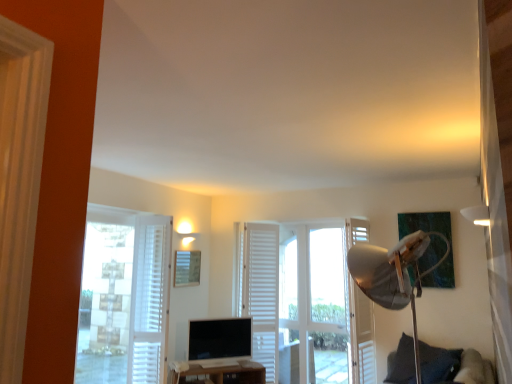
In order to face white textured curtain at left, the second curtain when ordered from right to left, should I rotate leftwards or rightwards?

A 13.966 degree turn to the left will do.

This screenshot has height=384, width=512. In order to click on white textured curtain at left, which ranks as the 1th curtain in front-to-back order in this screenshot , I will do `click(150, 300)`.

Describe the element at coordinates (437, 363) in the screenshot. I see `dark blue fabric pillow at lower right` at that location.

Find the location of a particular element. Image resolution: width=512 pixels, height=384 pixels. wooden picture frame at center is located at coordinates (187, 268).

Measure the distance between point (349, 364) and camera.

The depth of point (349, 364) is 4.70 meters.

Image resolution: width=512 pixels, height=384 pixels. What do you see at coordinates (262, 293) in the screenshot?
I see `white matte curtain at center, the second curtain when ordered from left to right` at bounding box center [262, 293].

Locate an element on the screen. This screenshot has height=384, width=512. white textured curtain at left, which is counted as the 2th curtain, starting from the back is located at coordinates (150, 300).

From the image's perspective, relative to white matte lampshade at upper right, is dark blue fabric pillow at lower right above or below?

Clearly, from the image's perspective, dark blue fabric pillow at lower right is below white matte lampshade at upper right.

From a real-world perspective, does dark blue fabric pillow at lower right sit lower than white matte lampshade at upper right?

Indeed, from a real-world perspective, dark blue fabric pillow at lower right is positioned beneath white matte lampshade at upper right.

Which is farther, [398,365] or [477,211]?

The point [477,211] is farther.

Is dark blue fabric pillow at lower right at the right side of white matte lampshade at upper right?

Yes, dark blue fabric pillow at lower right is to the right of white matte lampshade at upper right.

Which is more to the right, white wooden screen door at right or white wooden door at center?

Positioned to the right is white wooden screen door at right.

Is white wooden screen door at right positioned in front of white wooden door at center?

Yes, it is in front of white wooden door at center.

How different are the orientations of white wooden screen door at right and white wooden door at center in degrees?

72.8 degrees.

Is white wooden screen door at right facing towards white wooden door at center?

No, white wooden screen door at right is not turned towards white wooden door at center.

Which is behind, point (192, 343) or point (469, 211)?

Point (192, 343)

Which of these two, matte black computer monitor at center or white matte lampshade at upper right, is bigger?

matte black computer monitor at center is bigger.

Considering the relative sizes of matte black computer monitor at center and white matte lampshade at upper right in the image provided, is matte black computer monitor at center thinner than white matte lampshade at upper right?

Indeed, matte black computer monitor at center has a lesser width compared to white matte lampshade at upper right.

From a real-world perspective, between matte black computer monitor at center and white matte lampshade at upper right, who is vertically higher?

white matte lampshade at upper right is physically above.

Does matte black computer monitor at center appear on the right side of dark blue fabric pillow at lower right?

No.

Considering the positions of point (190, 348) and point (403, 339), is point (190, 348) closer or farther from the camera than point (403, 339)?

Clearly, point (190, 348) is more distant from the camera than point (403, 339).

Which is behind, matte black computer monitor at center or dark blue fabric pillow at lower right?

matte black computer monitor at center is further from the camera.

Can you confirm if matte black computer monitor at center is taller than dark blue fabric pillow at lower right?

No, matte black computer monitor at center is not taller than dark blue fabric pillow at lower right.

Consider the image. Measure the distance between white wooden screen door at right and wooden picture frame at center.

2.08 meters.

Is white wooden screen door at right turned away from wooden picture frame at center?

white wooden screen door at right does not have its back to wooden picture frame at center.

Considering the sizes of objects white wooden screen door at right and wooden picture frame at center in the image provided, who is taller, white wooden screen door at right or wooden picture frame at center?

With more height is white wooden screen door at right.

Does point (351, 241) appear closer or farther from the camera than point (186, 276)?

Point (351, 241).

Can you confirm if white matte lampshade at upper right is smaller than brown wooden tv stand at lower center?

Indeed, white matte lampshade at upper right has a smaller size compared to brown wooden tv stand at lower center.

From the image's perspective, which one is positioned higher, white matte lampshade at upper right or brown wooden tv stand at lower center?

white matte lampshade at upper right appears higher in the image.

Would you say white matte lampshade at upper right is outside brown wooden tv stand at lower center?

Indeed, white matte lampshade at upper right is completely outside brown wooden tv stand at lower center.

Consider the image. Is white matte lampshade at upper right touching brown wooden tv stand at lower center?

white matte lampshade at upper right and brown wooden tv stand at lower center are not in contact.

Which of these two, white matte lampshade at upper right or white wooden screen door at right, stands shorter?

white matte lampshade at upper right.

Considering the relative positions of white matte lampshade at upper right and white wooden screen door at right in the image provided, is white matte lampshade at upper right to the right of white wooden screen door at right from the viewer's perspective?

Yes, white matte lampshade at upper right is to the right of white wooden screen door at right.

From the image's perspective, is white matte lampshade at upper right on white wooden screen door at right?

Yes.

This screenshot has width=512, height=384. Find the location of `pillow behind the white matte lampshade at upper right`. pillow behind the white matte lampshade at upper right is located at coordinates (437, 363).

Find the location of a particular element. The width and height of the screenshot is (512, 384). screen door that is above the white wooden door at center (from a real-world perspective) is located at coordinates (361, 336).

When comparing their distances from wooden picture frame at center, does white matte curtain at center, the second curtain when ordered from left to right, or white wooden door at center seem closer?

The object closer to wooden picture frame at center is white matte curtain at center, the second curtain when ordered from left to right.

Which object lies nearer to the anchor point white wooden door at center, white textured curtain at left, the second curtain when ordered from right to left, or white matte curtain at center, the first curtain positioned from the right?

Based on the image, white matte curtain at center, the first curtain positioned from the right, appears to be nearer to white wooden door at center.

Considering their positions, is white wooden screen door at right positioned closer to white matte lampshade at upper right than brown wooden tv stand at lower center?

white wooden screen door at right lies closer to white matte lampshade at upper right than the other object.

In the scene shown: Estimate the real-world distances between objects in this image. Which object is further from brown wooden tv stand at lower center, matte black computer monitor at center or white textured curtain at left, the second curtain when ordered from right to left?

The object further to brown wooden tv stand at lower center is white textured curtain at left, the second curtain when ordered from right to left.

When comparing their distances from white wooden door at center, does matte black computer monitor at center or white textured curtain at left, which ranks as the 1th curtain in front-to-back order, seem closer?

Based on the image, matte black computer monitor at center appears to be nearer to white wooden door at center.

Based on their spatial positions, is wooden picture frame at center or white textured curtain at left, which is counted as the 2th curtain, starting from the back, further from white matte curtain at center, positioned as the first curtain in back-to-front order?

white textured curtain at left, which is counted as the 2th curtain, starting from the back, is further to white matte curtain at center, positioned as the first curtain in back-to-front order.

Based on their spatial positions, is white matte curtain at center, positioned as the first curtain in back-to-front order, or brown wooden tv stand at lower center closer to dark blue fabric pillow at lower right?

brown wooden tv stand at lower center.

From the picture: From the image, which object appears to be farther from dark blue fabric pillow at lower right, brown wooden tv stand at lower center or white wooden screen door at right?

brown wooden tv stand at lower center.

This screenshot has width=512, height=384. What are the coordinates of `screen door between white matte lampshade at upper right and matte black computer monitor at center from front to back` in the screenshot? It's located at (361, 336).

Find the location of `computer monitor between white textured curtain at left, which ranks as the 1th curtain in front-to-back order, and white wooden screen door at right from left to right`. computer monitor between white textured curtain at left, which ranks as the 1th curtain in front-to-back order, and white wooden screen door at right from left to right is located at coordinates (220, 338).

This screenshot has height=384, width=512. Identify the location of pillow between white matte lampshade at upper right and wooden picture frame at center from front to back. (437, 363).

In order to click on computer monitor between white textured curtain at left, which ranks as the 1th curtain in front-to-back order, and brown wooden tv stand at lower center in the up-down direction in this screenshot , I will do `click(220, 338)`.